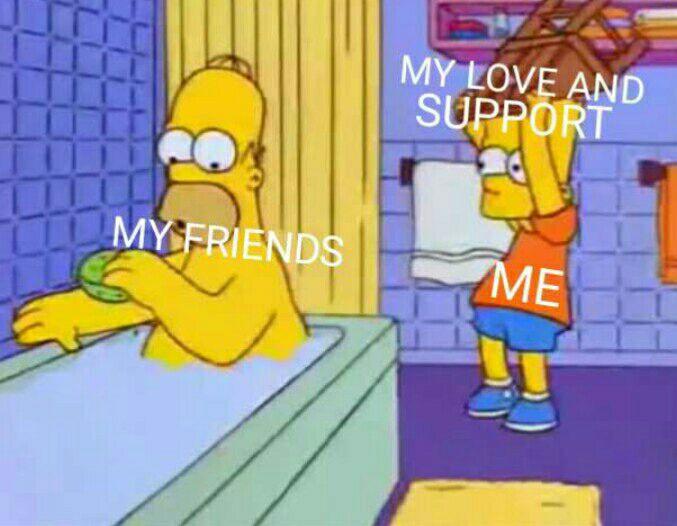
Where is `towels`? This screenshot has width=677, height=526. towels is located at coordinates (464, 202).